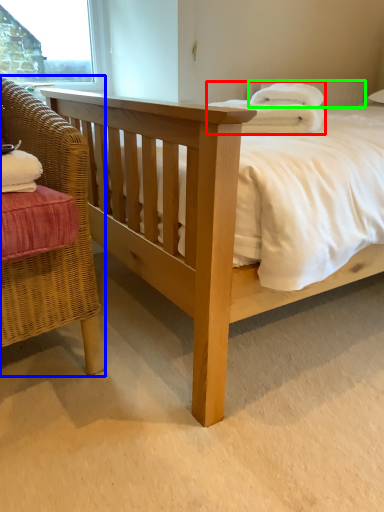
Question: Which is farther away from bath towel (highlighted by a red box)? chair (highlighted by a blue box) or pillow (highlighted by a green box)?

Choices:
 (A) chair
 (B) pillow

Answer: (B)